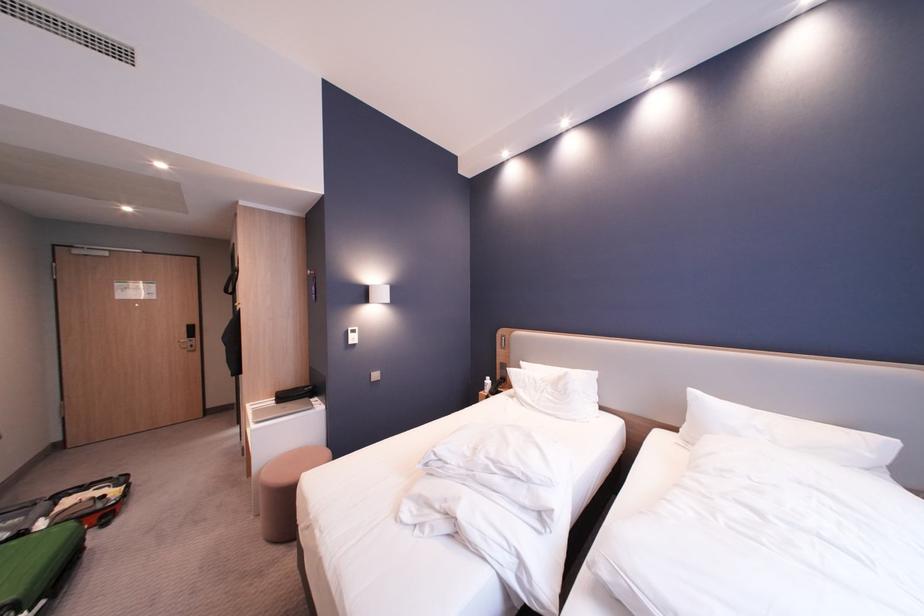
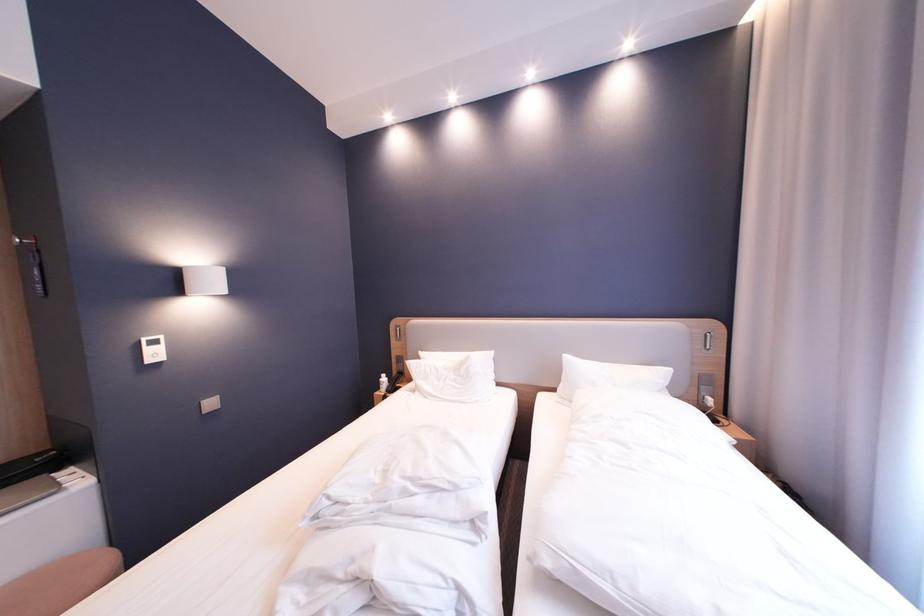
Question: The camera is either moving clockwise (left) or counter-clockwise (right) around the object. The first image is from the beginning of the video and the second image is from the end. Is the camera moving left or right when shooting the video?

Choices:
 (A) Left
 (B) Right

Answer: (A)